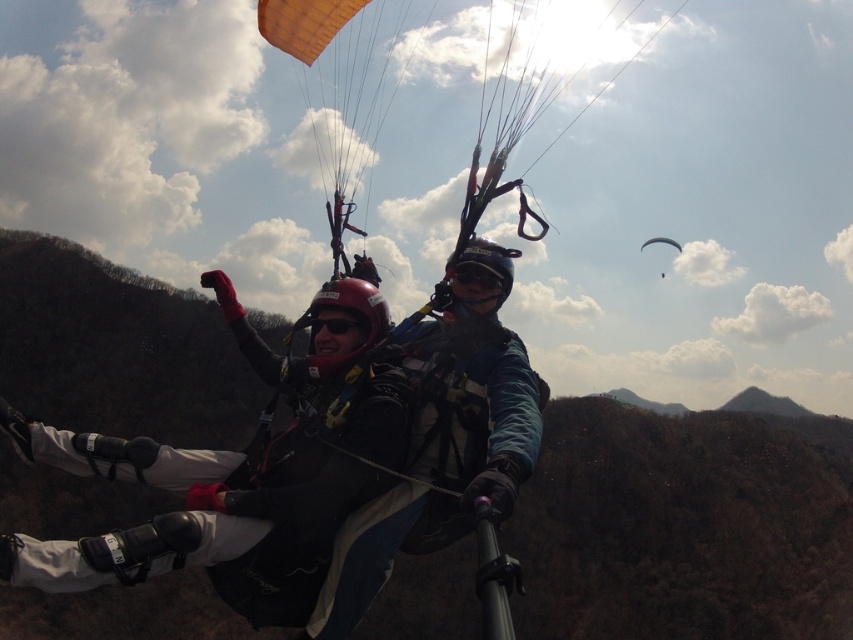
Question: Among these objects, which one is farthest from the camera?

Choices:
 (A) white matte parachute at upper center
 (B) brown textured mountain at center

Answer: (A)

Question: Can you confirm if matte black helmet at center is smaller than white matte parachute at upper center?

Choices:
 (A) no
 (B) yes

Answer: (A)

Question: Is the position of brown textured mountain at center more distant than that of matte black helmet at center?

Choices:
 (A) no
 (B) yes

Answer: (B)

Question: Which is farther from the brown textured mountain at center?

Choices:
 (A) matte black helmet at center
 (B) white matte parachute at upper center

Answer: (A)

Question: Is matte black helmet at center positioned in front of white matte parachute at upper center?

Choices:
 (A) yes
 (B) no

Answer: (A)

Question: Which object is the closest to the matte black helmet at center?

Choices:
 (A) white matte parachute at upper center
 (B) brown textured mountain at center

Answer: (B)